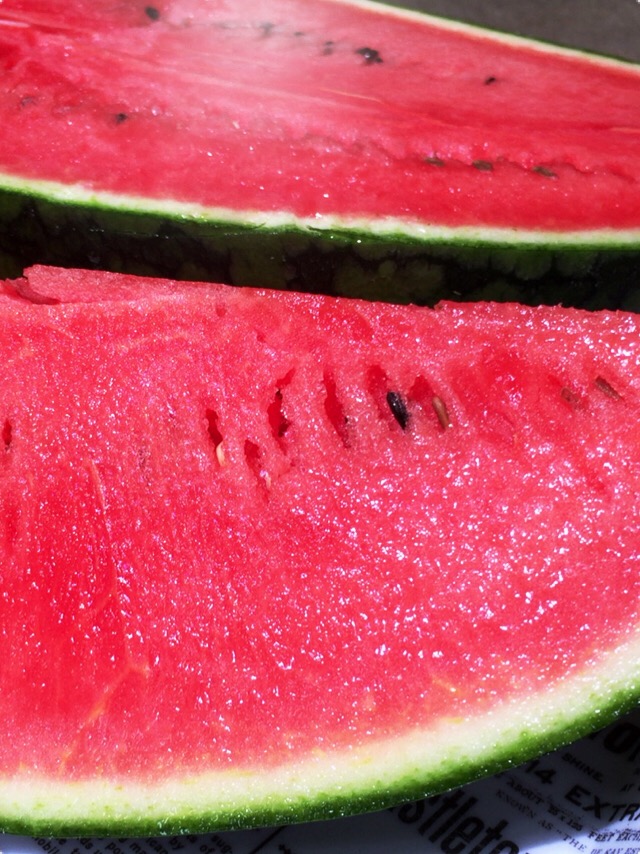
This screenshot has height=854, width=640. Find the location of `newspaper`. newspaper is located at coordinates (548, 816).